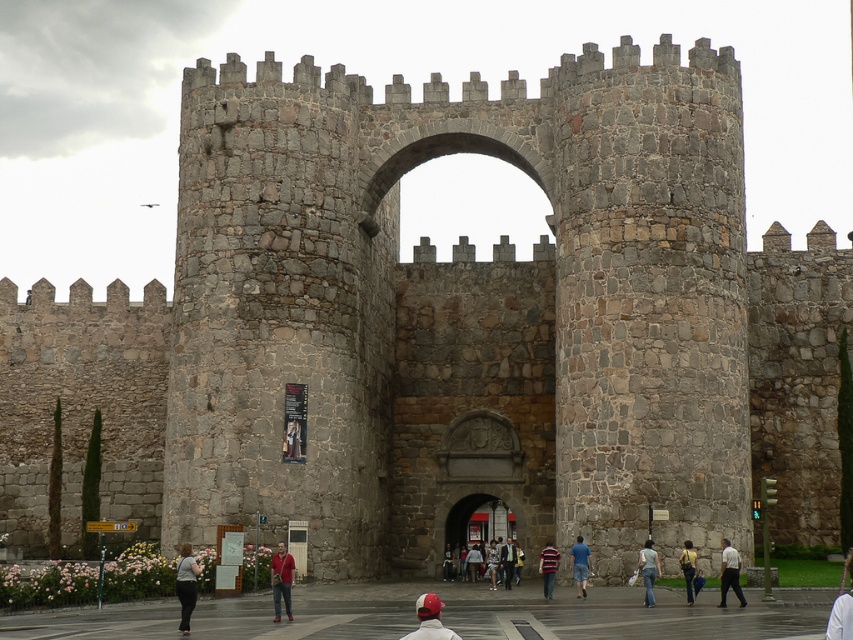
Question: Which point is farther from the camera taking this photo?

Choices:
 (A) (659, 566)
 (B) (846, 561)

Answer: (B)

Question: Which of the following is the closest to the observer?

Choices:
 (A) (651, 566)
 (B) (581, 548)
 (C) (506, 570)

Answer: (A)

Question: Among these points, which one is nearest to the camera?

Choices:
 (A) (729, 586)
 (B) (476, 570)
 (C) (693, 552)

Answer: (A)

Question: Is denim jeans at center bigger than striped cotton shirt at center?

Choices:
 (A) yes
 (B) no

Answer: (B)

Question: Where is dark gray pants at lower left located in relation to denim jeans at center in the image?

Choices:
 (A) above
 (B) below

Answer: (B)

Question: Is light brown leather jacket at center positioned in front of denim jeans at center?

Choices:
 (A) no
 (B) yes

Answer: (A)